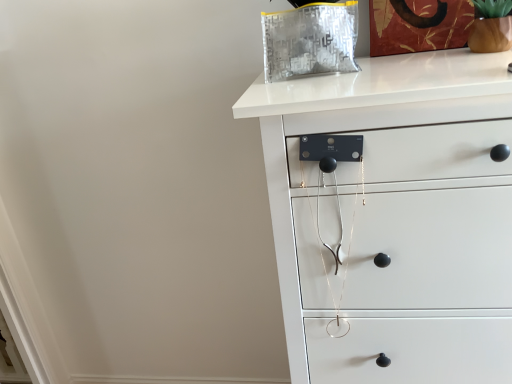
The image size is (512, 384). Find the location of `brown matte glass vase at upper right`. brown matte glass vase at upper right is located at coordinates (490, 34).

Measure the distance between brown matte glass vase at upper right and camera.

88.65 centimeters.

Describe the element at coordinates (490, 34) in the screenshot. I see `brown matte glass vase at upper right` at that location.

Where is `white matte chest of drawers at upper right`? This screenshot has width=512, height=384. white matte chest of drawers at upper right is located at coordinates (396, 219).

This screenshot has height=384, width=512. Describe the element at coordinates (396, 219) in the screenshot. I see `white matte chest of drawers at upper right` at that location.

Where is `brown matte glass vase at upper right`? Image resolution: width=512 pixels, height=384 pixels. brown matte glass vase at upper right is located at coordinates (490, 34).

Would you say white matte chest of drawers at upper right is to the left or to the right of brown matte glass vase at upper right in the picture?

From the image, it's evident that white matte chest of drawers at upper right is to the left of brown matte glass vase at upper right.

Does white matte chest of drawers at upper right come in front of brown matte glass vase at upper right?

Yes, white matte chest of drawers at upper right is closer to the viewer.

Is point (430, 121) behind point (495, 27)?

No, (430, 121) is closer to viewer.

From the image's perspective, which one is positioned lower, white matte chest of drawers at upper right or brown matte glass vase at upper right?

white matte chest of drawers at upper right is shown below in the image.

From a real-world perspective, is white matte chest of drawers at upper right on top of brown matte glass vase at upper right?

Incorrect, from a real-world perspective, white matte chest of drawers at upper right is lower than brown matte glass vase at upper right.

Which of these two, white matte chest of drawers at upper right or brown matte glass vase at upper right, is thinner?

With smaller width is brown matte glass vase at upper right.

Can you confirm if white matte chest of drawers at upper right is taller than brown matte glass vase at upper right?

Indeed, white matte chest of drawers at upper right has a greater height compared to brown matte glass vase at upper right.

Is white matte chest of drawers at upper right bigger or smaller than brown matte glass vase at upper right?

Considering their sizes, white matte chest of drawers at upper right takes up more space than brown matte glass vase at upper right.

Would you say white matte chest of drawers at upper right is inside or outside brown matte glass vase at upper right?

white matte chest of drawers at upper right is not inside brown matte glass vase at upper right, it's outside.

Is white matte chest of drawers at upper right far away from brown matte glass vase at upper right?

white matte chest of drawers at upper right is actually quite close to brown matte glass vase at upper right.

Is white matte chest of drawers at upper right oriented away from brown matte glass vase at upper right?

No, brown matte glass vase at upper right is not at the back of white matte chest of drawers at upper right.

Can you tell me how much white matte chest of drawers at upper right and brown matte glass vase at upper right differ in facing direction?

They differ by 4.49 degrees in their facing directions.

The image size is (512, 384). Find the location of `the chest of drawers that is in front of the brown matte glass vase at upper right`. the chest of drawers that is in front of the brown matte glass vase at upper right is located at coordinates tap(396, 219).

Which is more to the left, brown matte glass vase at upper right or white matte chest of drawers at upper right?

white matte chest of drawers at upper right is more to the left.

Relative to white matte chest of drawers at upper right, is brown matte glass vase at upper right in front or behind?

brown matte glass vase at upper right is positioned farther from the viewer than white matte chest of drawers at upper right.

Considering the points (499, 38) and (357, 87), which point is in front, point (499, 38) or point (357, 87)?

The point (357, 87) is more forward.

From the image's perspective, who appears lower, brown matte glass vase at upper right or white matte chest of drawers at upper right?

white matte chest of drawers at upper right is shown below in the image.

From a real-world perspective, is brown matte glass vase at upper right physically located above or below white matte chest of drawers at upper right?

In terms of real-world spatial position, brown matte glass vase at upper right is above white matte chest of drawers at upper right.

Considering the relative sizes of brown matte glass vase at upper right and white matte chest of drawers at upper right in the image provided, is brown matte glass vase at upper right wider than white matte chest of drawers at upper right?

In fact, brown matte glass vase at upper right might be narrower than white matte chest of drawers at upper right.

Can you confirm if brown matte glass vase at upper right is shorter than white matte chest of drawers at upper right?

Yes, brown matte glass vase at upper right is shorter than white matte chest of drawers at upper right.

Based on their sizes in the image, would you say brown matte glass vase at upper right is bigger or smaller than white matte chest of drawers at upper right?

Considering their sizes, brown matte glass vase at upper right takes up less space than white matte chest of drawers at upper right.

Is white matte chest of drawers at upper right located within brown matte glass vase at upper right?

Actually, white matte chest of drawers at upper right is outside brown matte glass vase at upper right.

Can you see brown matte glass vase at upper right touching white matte chest of drawers at upper right?

No, brown matte glass vase at upper right is not next to white matte chest of drawers at upper right.

Is brown matte glass vase at upper right facing away from white matte chest of drawers at upper right?

No, brown matte glass vase at upper right is not facing away from white matte chest of drawers at upper right.

What's the angular difference between brown matte glass vase at upper right and white matte chest of drawers at upper right's facing directions?

They differ by 4.49 degrees in their facing directions.

How distant is brown matte glass vase at upper right from white matte chest of drawers at upper right?

brown matte glass vase at upper right is 19.26 inches away from white matte chest of drawers at upper right.

You are a GUI agent. You are given a task and a screenshot of the screen. Output one action in this format:
    pyautogui.click(x=<x>, y=<y>)
    Task: Click on the chest of drawers on the left of brown matte glass vase at upper right
    
    Given the screenshot: What is the action you would take?
    pyautogui.click(x=396, y=219)

Locate an element on the screen. glass vase behind the white matte chest of drawers at upper right is located at coordinates (490, 34).

The image size is (512, 384). What are the coordinates of `chest of drawers in front of the brown matte glass vase at upper right` in the screenshot? It's located at (396, 219).